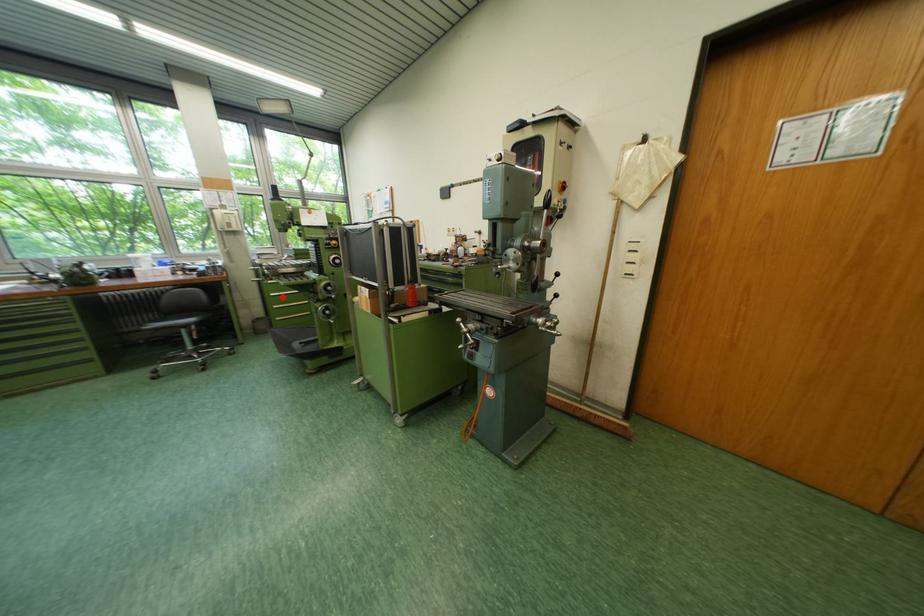
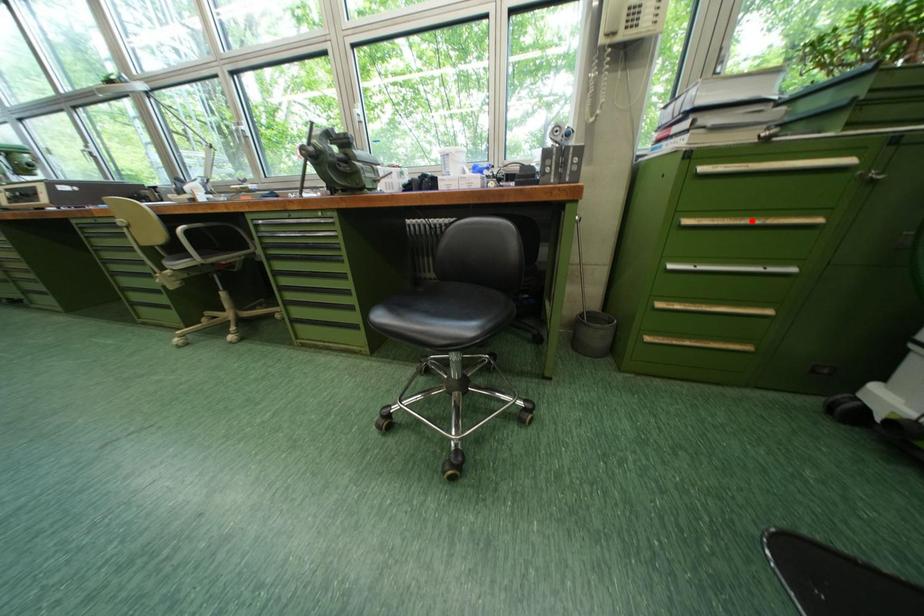
I am providing you with two images of the same scene from different viewpoints. A red point is marked on the first image and another point is marked on the second image. Is the red point in image1 aligned with the point shown in image2?

No